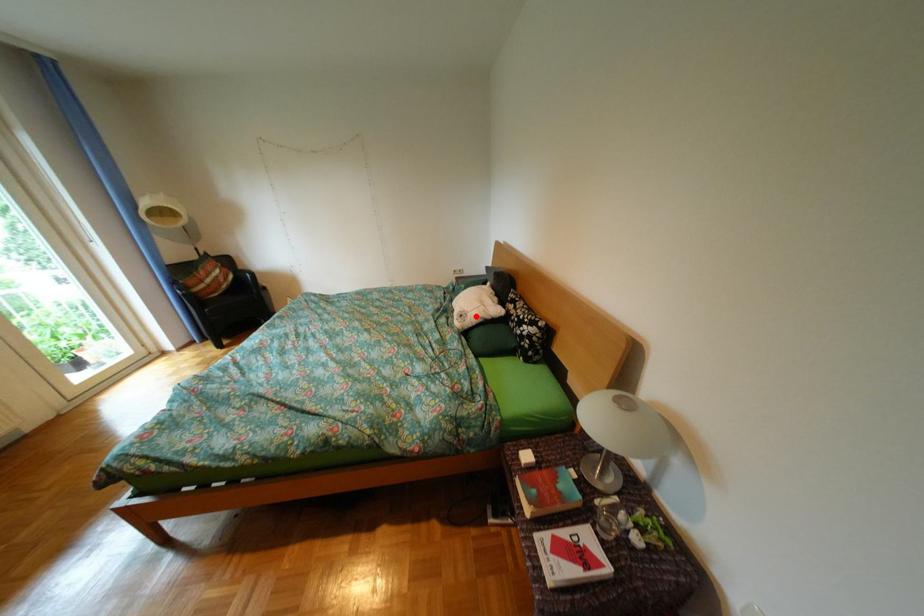
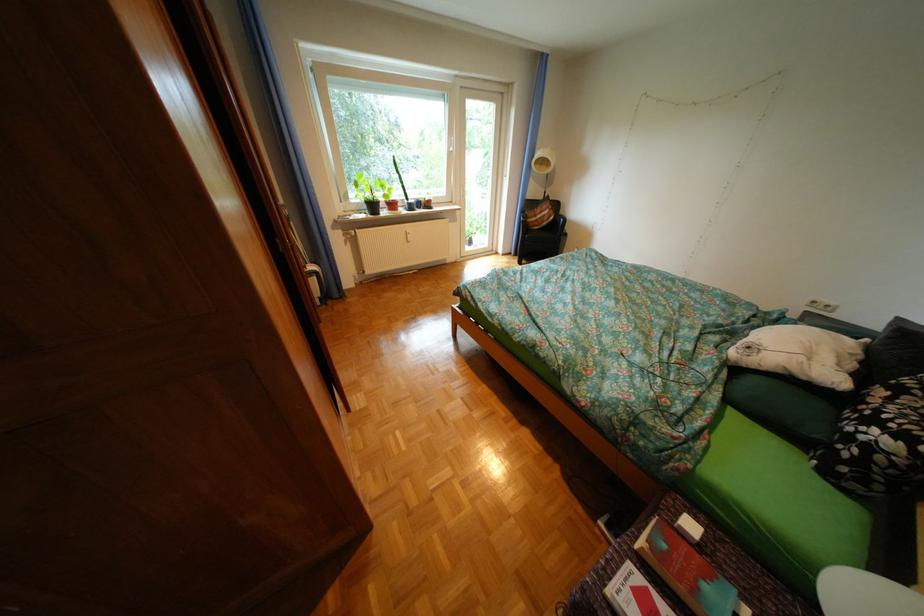
Find the pixel in the second image that matches the highlighted location in the first image.

(763, 349)